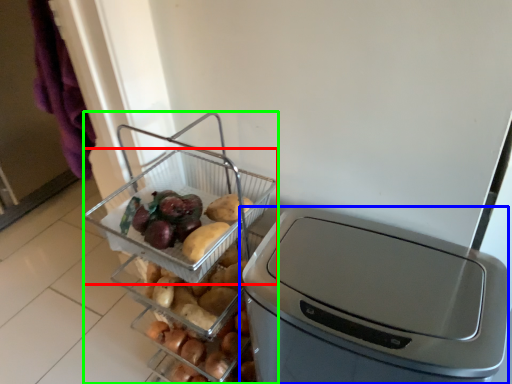
Question: Which is farther away from basket (highlighted by a red box)? home appliance (highlighted by a blue box) or appliance (highlighted by a green box)?

Choices:
 (A) home appliance
 (B) appliance

Answer: (A)